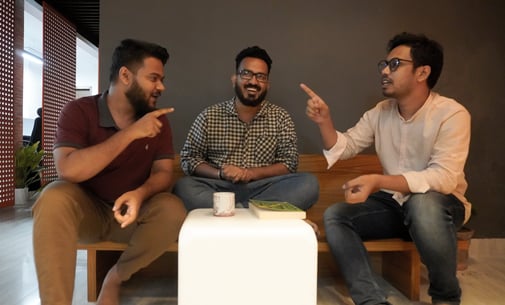
Find the location of a particular element. This screenshot has height=305, width=505. plant is located at coordinates (24, 163).